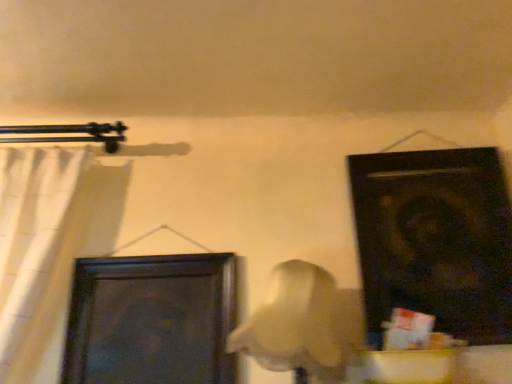
Question: From the image's perspective, is black matte door at upper right, acting as the 2th door starting from the left, positioned above or below white fabric curtain at left?

Choices:
 (A) below
 (B) above

Answer: (B)

Question: In terms of height, does black matte door at upper right, acting as the 2th door starting from the left, look taller or shorter compared to white fabric curtain at left?

Choices:
 (A) tall
 (B) short

Answer: (A)

Question: Considering the real-world distances, which object is closest to the white fabric curtain at left?

Choices:
 (A) dark wood door at center-left, the first door viewed from the left
 (B) black matte door at upper right, acting as the 2th door starting from the left

Answer: (A)

Question: Estimate the real-world distances between objects in this image. Which object is closer to the black matte door at upper right, the 1th door positioned from the right?

Choices:
 (A) dark wood door at center-left, which is the second door from right to left
 (B) white fabric curtain at left

Answer: (A)